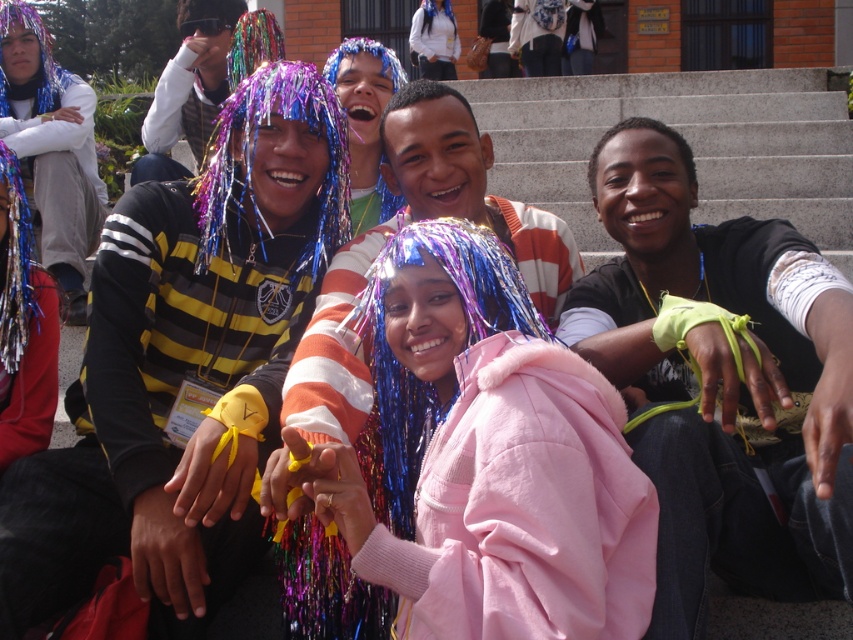
Who is higher up, pink fleece jacket at center or neon green fabric at center?

neon green fabric at center

From the picture: Who is positioned more to the right, pink fleece jacket at center or neon green fabric at center?

From the viewer's perspective, neon green fabric at center appears more on the right side.

Which is behind, point (502, 499) or point (833, 496)?

Point (833, 496)

The image size is (853, 640). Find the location of `pink fleece jacket at center`. pink fleece jacket at center is located at coordinates (497, 456).